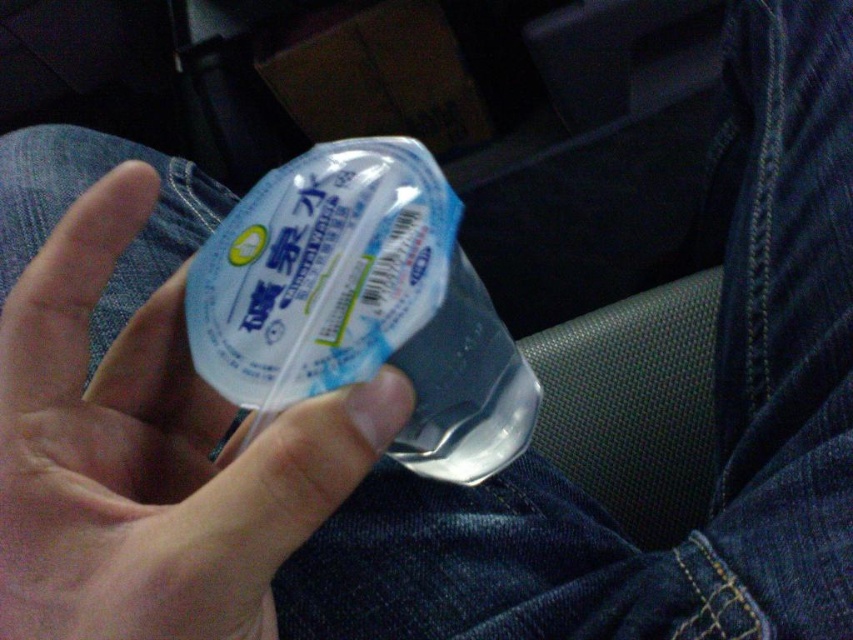
Question: Can you confirm if transparent plastic hand at center is positioned to the left of transparent plastic bottle at center?

Choices:
 (A) yes
 (B) no

Answer: (A)

Question: Which of the following is the closest to the observer?

Choices:
 (A) (183, 472)
 (B) (329, 188)

Answer: (B)

Question: Does transparent plastic hand at center appear under transparent plastic bottle at center?

Choices:
 (A) no
 (B) yes

Answer: (B)

Question: Can you confirm if transparent plastic hand at center is smaller than transparent plastic bottle at center?

Choices:
 (A) no
 (B) yes

Answer: (B)

Question: Which of the following is the farthest from the observer?

Choices:
 (A) (369, 358)
 (B) (78, 202)

Answer: (B)